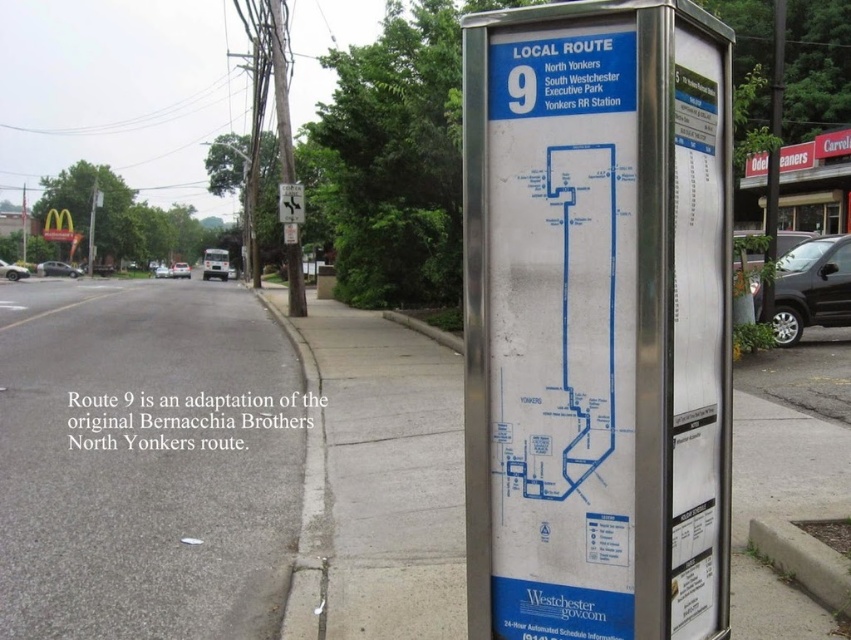
Which is above, brushed metal pole at right or metallic silver street sign at upper center?

brushed metal pole at right

Can you confirm if brushed metal pole at right is wider than metallic silver street sign at upper center?

Indeed, brushed metal pole at right has a greater width compared to metallic silver street sign at upper center.

The width and height of the screenshot is (851, 640). I want to click on brushed metal pole at right, so click(x=774, y=131).

Between silver metallic bus stop sign at center and metallic silver street sign at upper center, which one is positioned lower?

silver metallic bus stop sign at center

This screenshot has width=851, height=640. What do you see at coordinates (597, 321) in the screenshot?
I see `silver metallic bus stop sign at center` at bounding box center [597, 321].

Where is `silver metallic bus stop sign at center`? This screenshot has width=851, height=640. silver metallic bus stop sign at center is located at coordinates [597, 321].

Which is above, silver metallic pavement at center or metallic silver street sign at upper center?

Positioned higher is metallic silver street sign at upper center.

Identify the location of silver metallic pavement at center. The width and height of the screenshot is (851, 640). (390, 476).